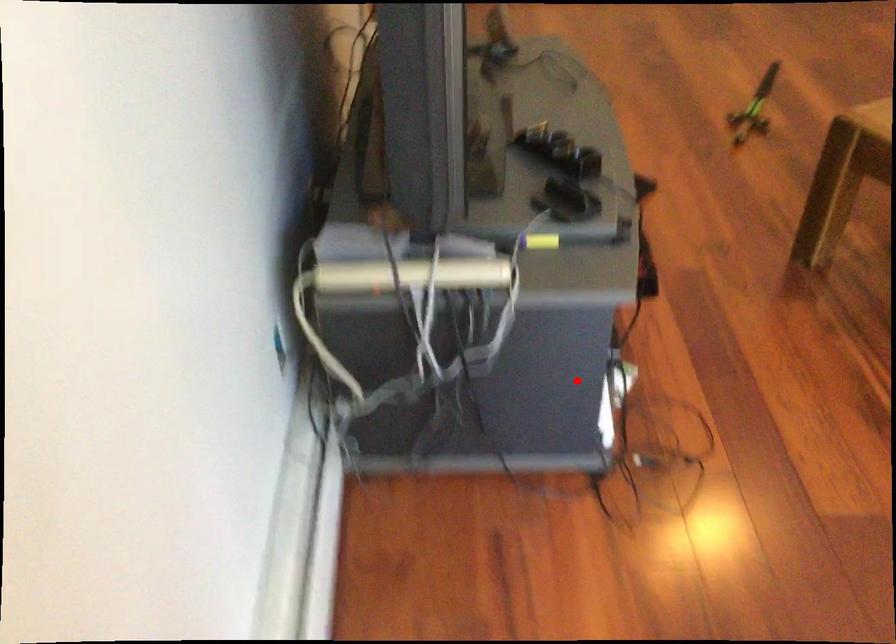
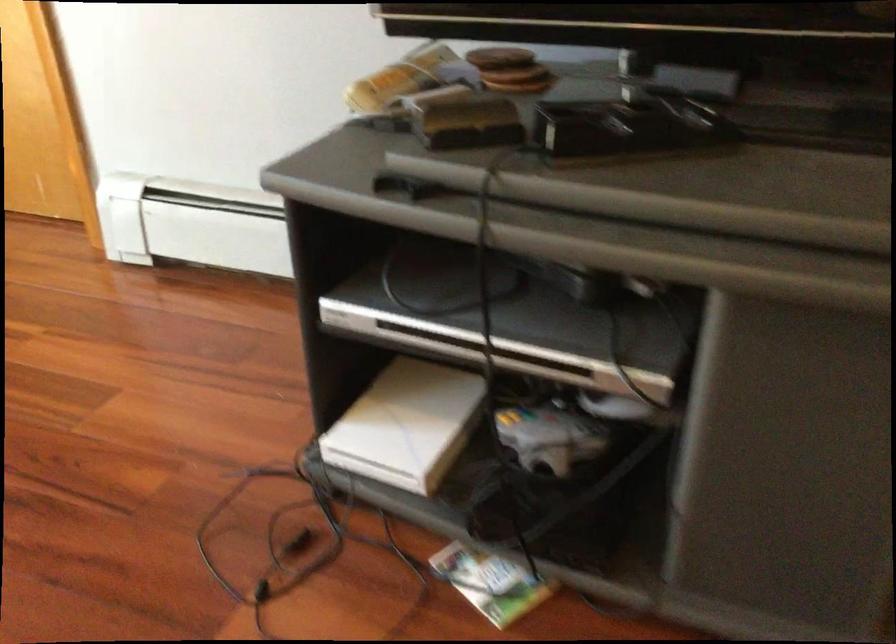
Question: I am providing you with two images of the same scene from different viewpoints. In image1, a red point is highlighted. Considering the same 3D point in image2, which of the following is correct?

Choices:
 (A) It is closer
 (B) It is farther

Answer: (A)